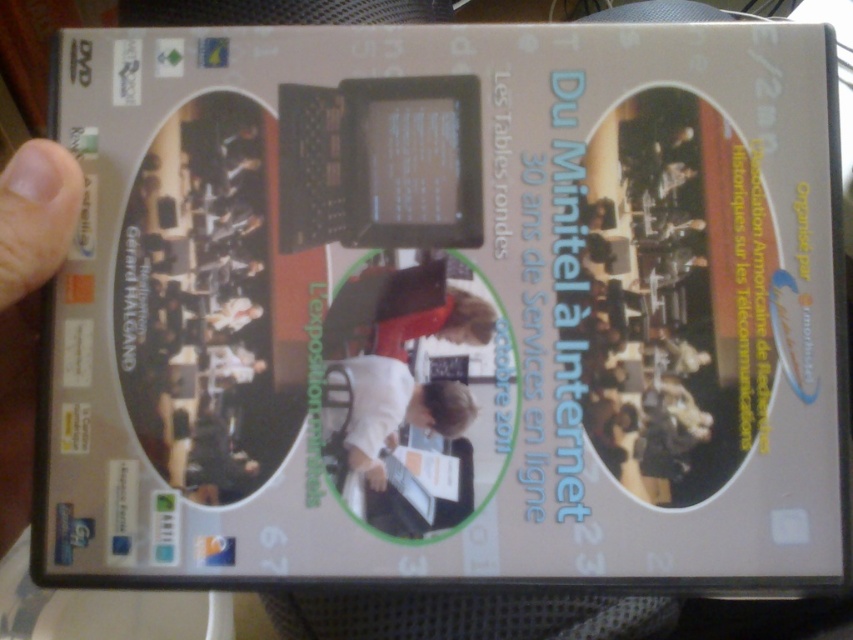
Based on the DVD cover scene described, which object is positioned higher up in the image between the white fabric shirt at center and the white matte hand at lower center?

The white fabric shirt at center is taller than the white matte hand at lower center, meaning it is positioned higher up in the image.

You are an assistant helping someone choose clothing for a presentation. The person wants to ensure their shirt and hand accessories are proportionally balanced. Given the image of the person in the DVD cover, does the white fabric shirt at center and the white matte hand at lower center appear proportionally balanced?

The white fabric shirt at center has a larger size compared to the white matte hand at lower center, so they do not appear proportionally balanced as the shirt is significantly larger than the hand.

You are designing a poster and want to place a star sticker on the point at point (42,224). If the poster is 24 inches wide and 36 inches tall, will the star sticker fit within the poster dimensions?

The point (42,224) is located at 0.350 of the poster width and 0.050 of the poster height. Calculating the position, 24 inches multiplied by 0.350 gives 8.4 inches from the left edge, and 36 inches multiplied by 0.050 gives 1.8 inches from the bottom edge. Since both coordinates are within the poster dimensions, the star sticker will fit within the poster dimensions.